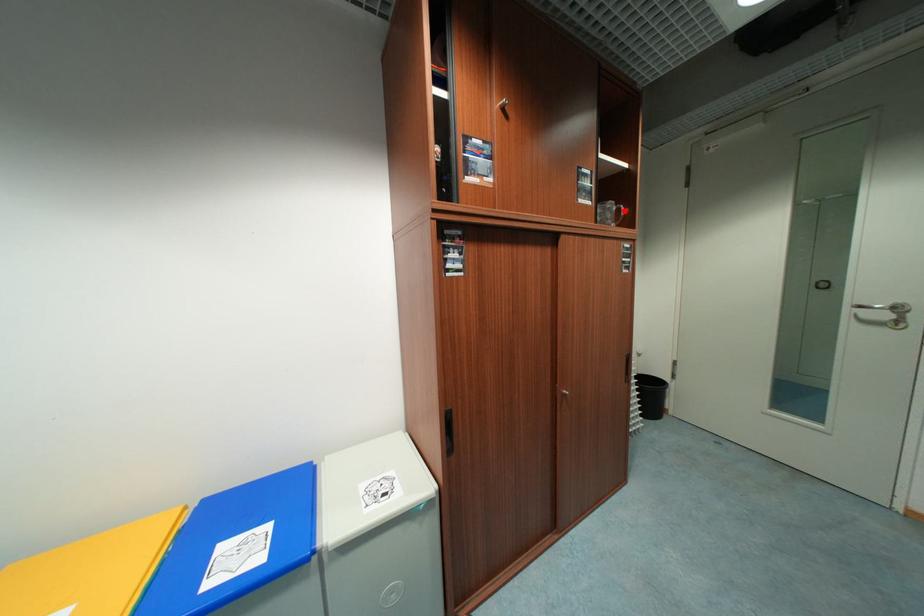
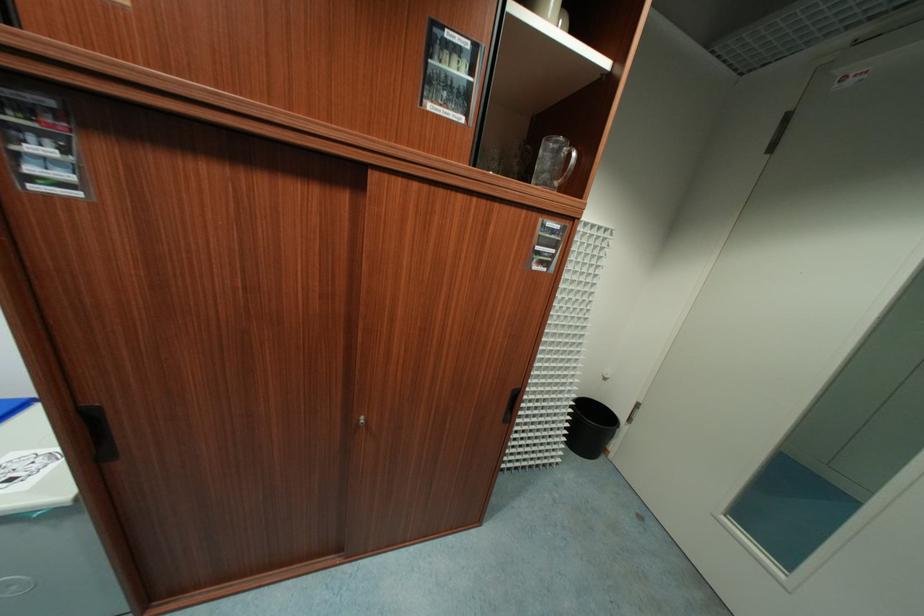
In the second image, find the point that corresponds to the highlighted location in the first image.

(574, 158)